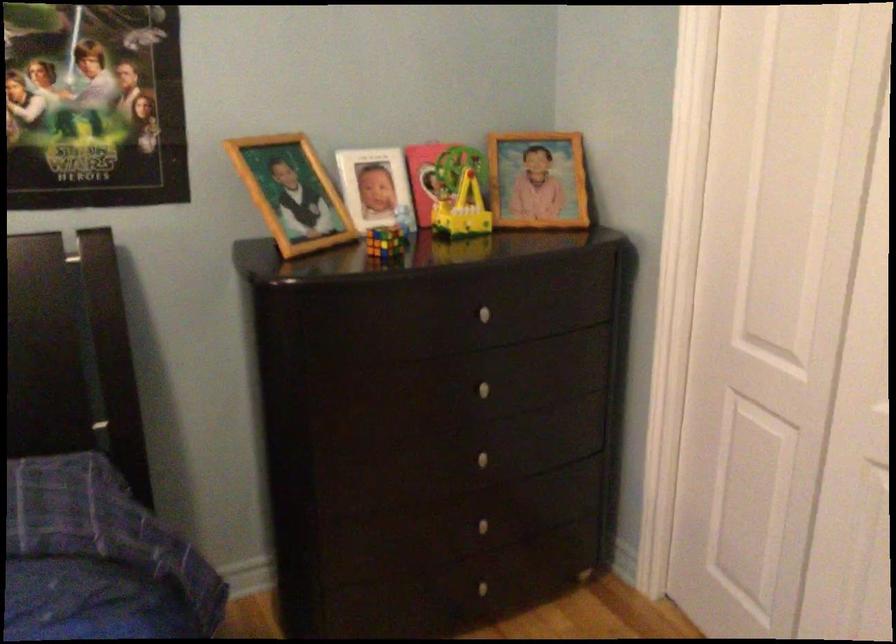
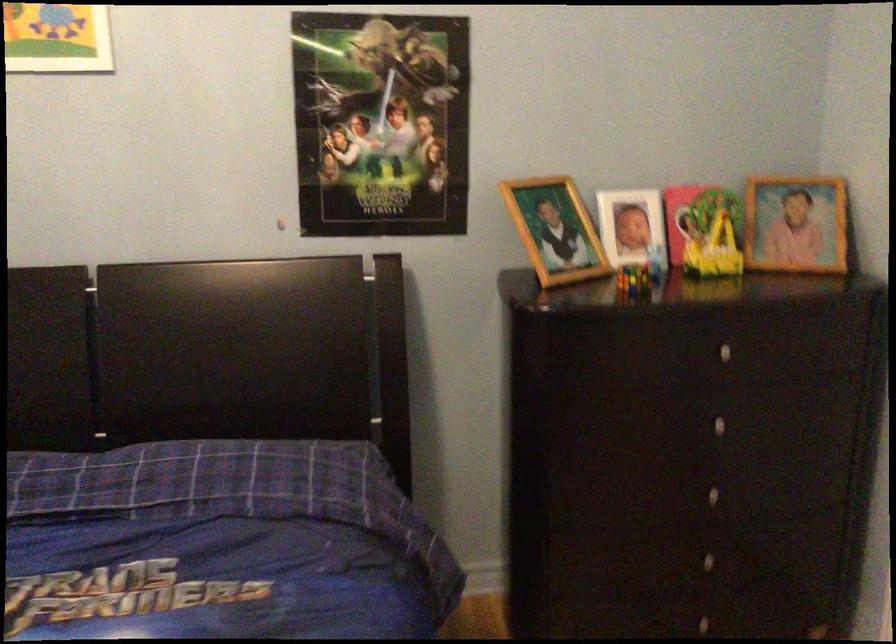
Question: The images are taken continuously from a first-person perspective. In which direction are you moving?

Choices:
 (A) Left
 (B) Right
 (C) Forward
 (D) Backward

Answer: (D)